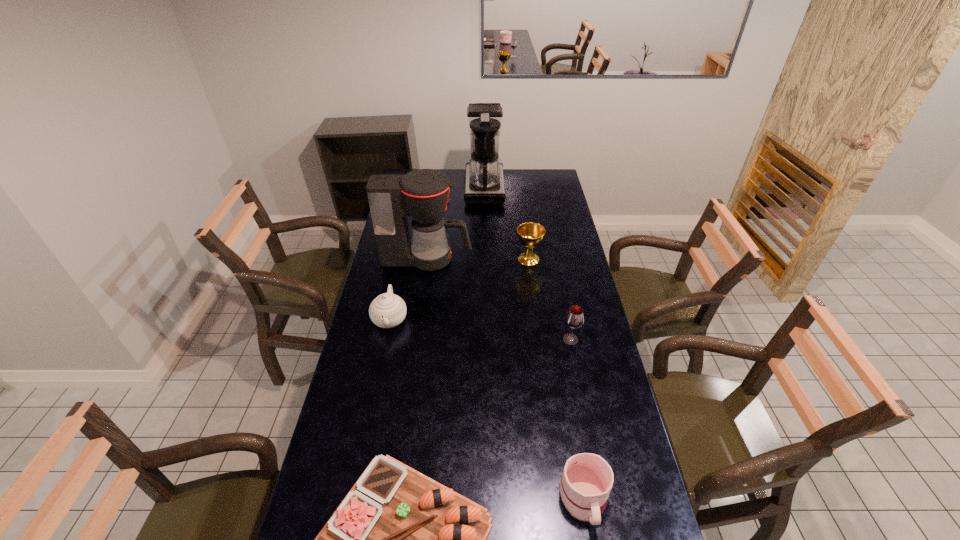
Find the location of `blank space located on the front of the chalice`. blank space located on the front of the chalice is located at coordinates (535, 304).

Identify the location of vacant space located 0.250m on the front of the wineglass. The image size is (960, 540). (584, 407).

Find the location of a particular element. This screenshot has height=540, width=960. free space located on the spout of the chinaware is located at coordinates (371, 413).

At what (x,y) coordinates should I click in order to perform the action: click on object located in the far edge section of the desktop. Please return your answer as a coordinate pair (x, y). This screenshot has height=540, width=960. Looking at the image, I should click on (484, 183).

Identify the location of coffee maker that is at the left edge. (422, 194).

The image size is (960, 540). Find the location of `chinaware present at the left edge`. chinaware present at the left edge is located at coordinates (388, 310).

This screenshot has width=960, height=540. I want to click on wineglass at the right edge, so click(x=574, y=318).

Where is `mug present at the right edge`? The height and width of the screenshot is (540, 960). mug present at the right edge is located at coordinates (586, 481).

In the image, there is a desktop. Where is `vacant space at the far edge`? The image size is (960, 540). vacant space at the far edge is located at coordinates (514, 187).

Where is `blank space at the left edge of the desktop`? blank space at the left edge of the desktop is located at coordinates (397, 282).